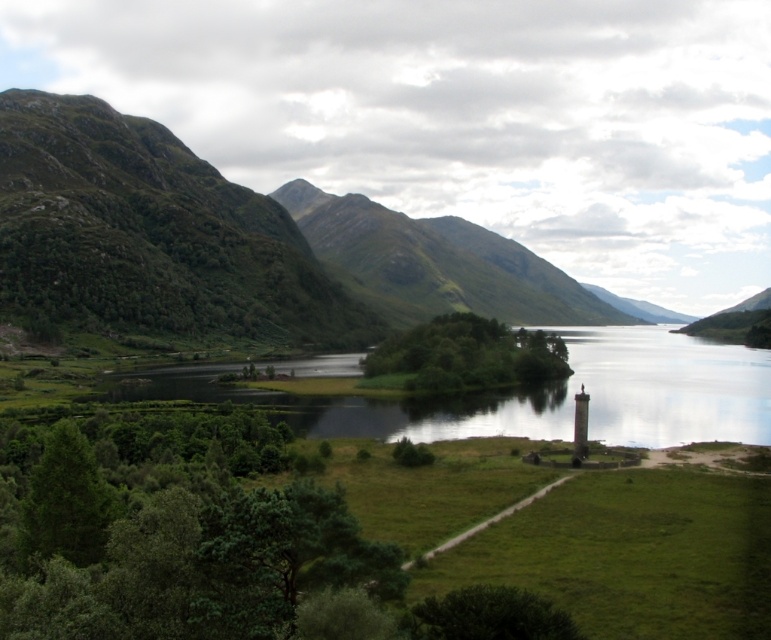
Does green grassy water at center appear on the left side of green leafy tree at center?

Incorrect, green grassy water at center is not on the left side of green leafy tree at center.

From the picture: Does green grassy water at center have a smaller size compared to green leafy tree at center?

Actually, green grassy water at center might be larger than green leafy tree at center.

Describe the element at coordinates (537, 396) in the screenshot. I see `green grassy water at center` at that location.

Find the location of a particular element. green grassy water at center is located at coordinates (537, 396).

Is point (214, 381) positioned behind point (66, 538)?

Yes, it is behind point (66, 538).

At what (x,y) coordinates should I click in order to perform the action: click on green grassy water at center. Please return your answer as a coordinate pair (x, y). The image size is (771, 640). Looking at the image, I should click on (537, 396).

Describe the element at coordinates (537, 396) in the screenshot. I see `green grassy water at center` at that location.

The width and height of the screenshot is (771, 640). Find the location of `green grassy water at center`. green grassy water at center is located at coordinates (537, 396).

Is green leafy tree at center positioned at the back of green leafy tree at lower left?

Yes, it is behind green leafy tree at lower left.

Which is behind, point (453, 348) or point (68, 474)?

Point (453, 348)

Is point (423, 339) closer to viewer compared to point (54, 513)?

That is False.

Where is `green leafy tree at center`? green leafy tree at center is located at coordinates (463, 356).